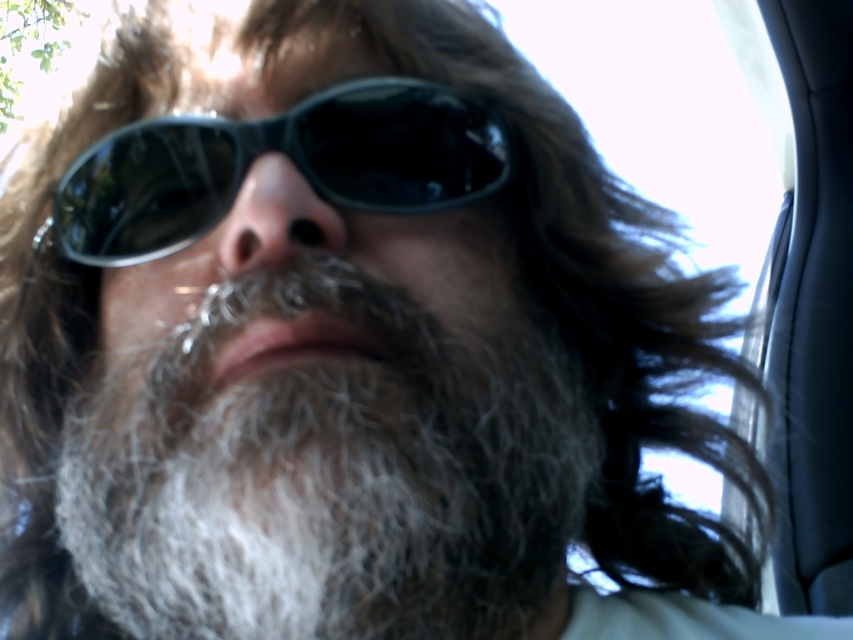
Question: Can you confirm if gray fuzzy beard at center is positioned below black plastic sunglasses at center?

Choices:
 (A) yes
 (B) no

Answer: (A)

Question: Among these objects, which one is nearest to the camera?

Choices:
 (A) gray fuzzy beard at center
 (B) black plastic sunglasses at center

Answer: (A)

Question: Observing the image, what is the correct spatial positioning of gray fuzzy beard at center in reference to black plastic sunglasses at center?

Choices:
 (A) above
 (B) below

Answer: (B)

Question: Is gray fuzzy beard at center positioned behind black plastic sunglasses at center?

Choices:
 (A) no
 (B) yes

Answer: (A)